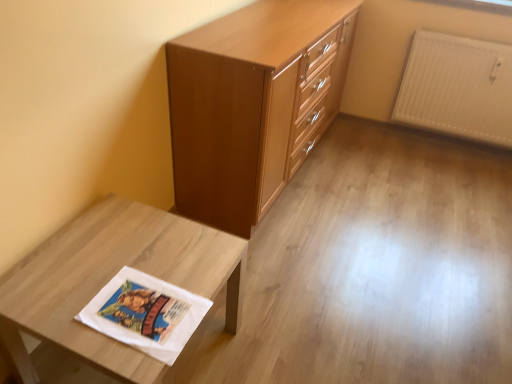
Where is `vacant area in front of white textured radiator at upper right`? This screenshot has width=512, height=384. vacant area in front of white textured radiator at upper right is located at coordinates (457, 176).